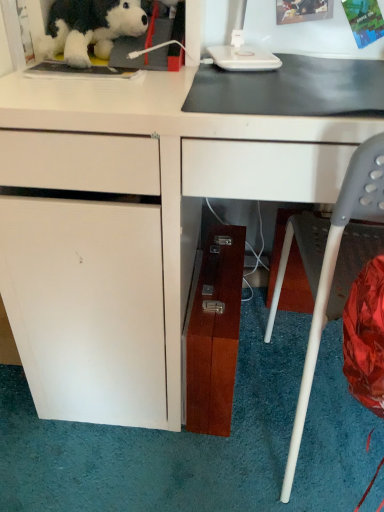
Question: Is fluffy plush dog at upper left to the right of gray plastic chair at lower right from the viewer's perspective?

Choices:
 (A) yes
 (B) no

Answer: (B)

Question: Is fluffy plush dog at upper left positioned with its back to gray plastic chair at lower right?

Choices:
 (A) yes
 (B) no

Answer: (B)

Question: Is there a large distance between fluffy plush dog at upper left and gray plastic chair at lower right?

Choices:
 (A) no
 (B) yes

Answer: (A)

Question: Can you confirm if fluffy plush dog at upper left is smaller than gray plastic chair at lower right?

Choices:
 (A) yes
 (B) no

Answer: (A)

Question: Can you see fluffy plush dog at upper left touching gray plastic chair at lower right?

Choices:
 (A) yes
 (B) no

Answer: (B)

Question: From the image's perspective, is fluffy plush dog at upper left over gray plastic chair at lower right?

Choices:
 (A) no
 (B) yes

Answer: (B)

Question: Is white matte desk at center facing away from wooden file cabinet at lower center?

Choices:
 (A) yes
 (B) no

Answer: (B)

Question: Are white matte desk at center and wooden file cabinet at lower center beside each other?

Choices:
 (A) no
 (B) yes

Answer: (A)

Question: Is white matte desk at center positioned behind wooden file cabinet at lower center?

Choices:
 (A) yes
 (B) no

Answer: (B)

Question: From a real-world perspective, does white matte desk at center sit lower than wooden file cabinet at lower center?

Choices:
 (A) no
 (B) yes

Answer: (A)

Question: From the image's perspective, does white matte desk at center appear higher than wooden file cabinet at lower center?

Choices:
 (A) no
 (B) yes

Answer: (B)

Question: Is white matte desk at center positioned far away from wooden file cabinet at lower center?

Choices:
 (A) no
 (B) yes

Answer: (A)

Question: Can we say white matte desk at center lies outside fluffy plush dog at upper left?

Choices:
 (A) no
 (B) yes

Answer: (B)